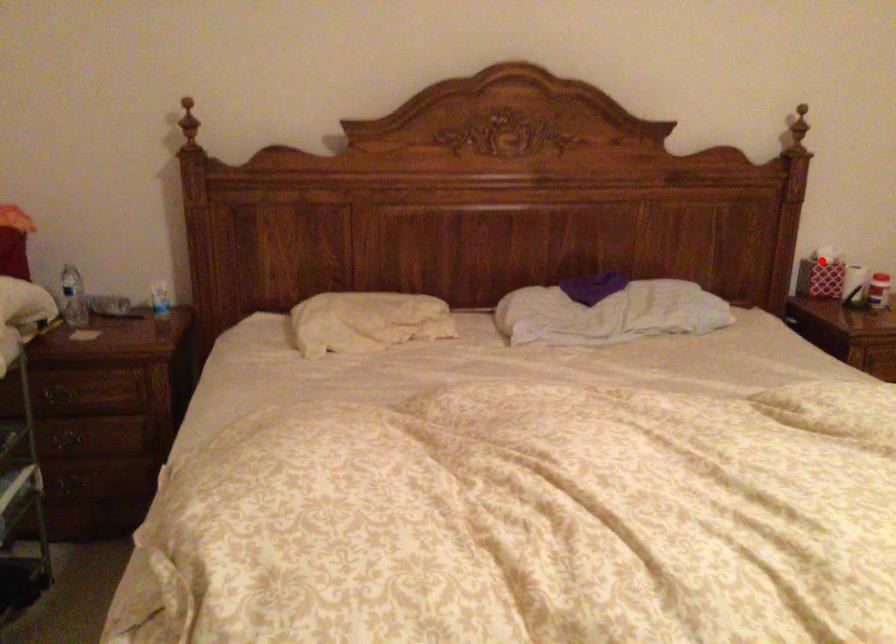
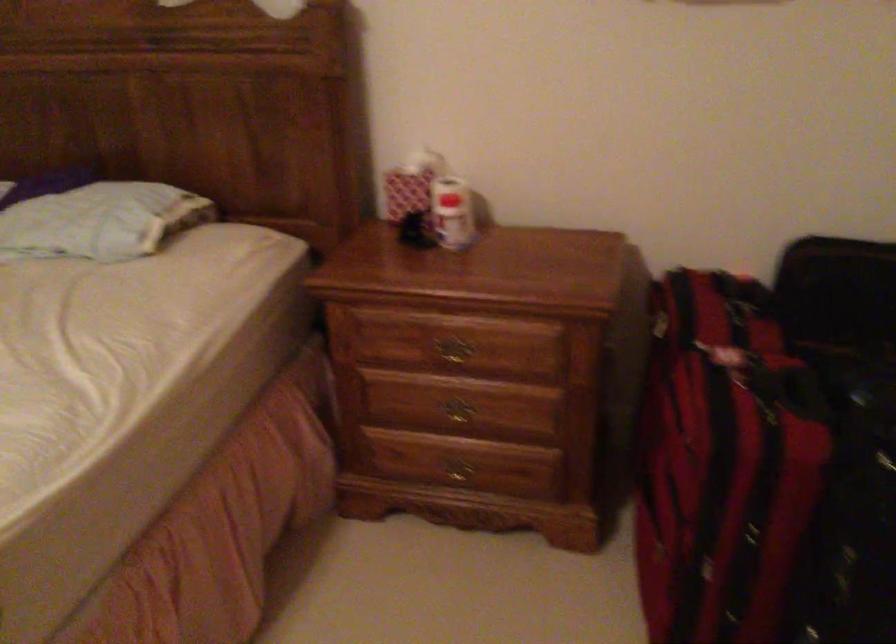
Question: I am providing you with two images of the same scene from different viewpoints. Given a red point in image1, look at the same physical point in image2. Is it:

Choices:
 (A) Closer to the viewpoint
 (B) Farther from the viewpoint

Answer: (A)